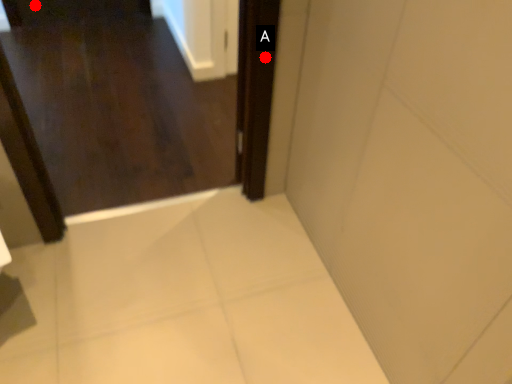
Question: Two points are circled on the image, labeled by A and B beside each circle. Which point is farther to the camera?

Choices:
 (A) A is further
 (B) B is further

Answer: (B)